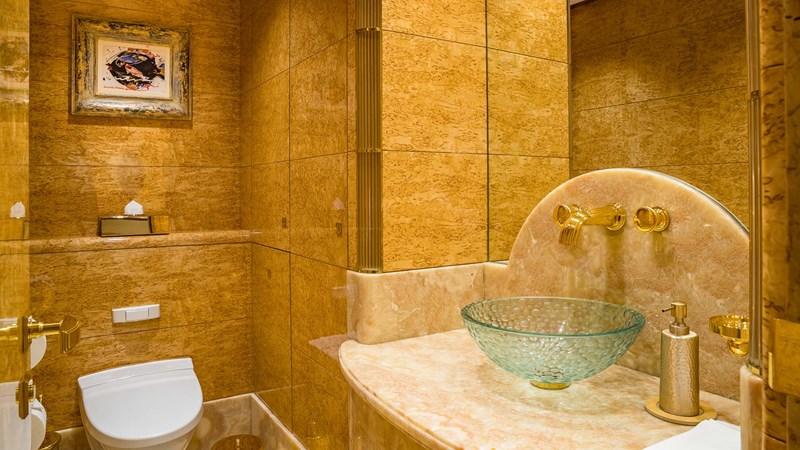
Locate an element on the screen. faucet is located at coordinates pyautogui.click(x=598, y=212).